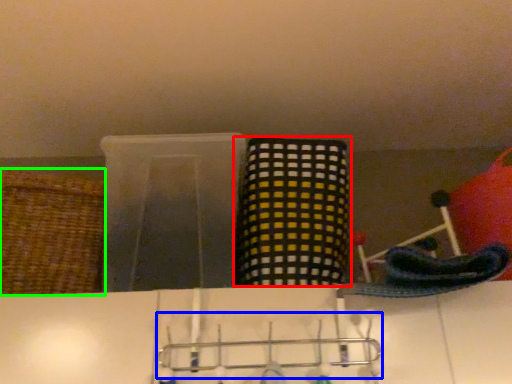
Question: Which is nearer to the basket (highlighted by a red box)? hanger (highlighted by a blue box) or basket (highlighted by a green box).

Choices:
 (A) hanger
 (B) basket

Answer: (A)